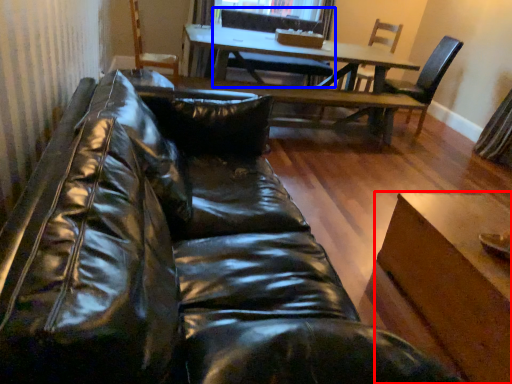
Question: Among these objects, which one is farthest to the camera, table (highlighted by a red box) or chair (highlighted by a blue box)?

Choices:
 (A) table
 (B) chair

Answer: (B)